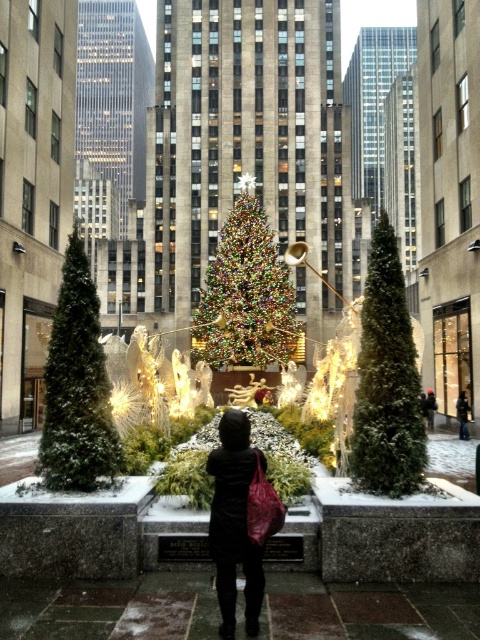
Measure the distance from black matte coat at center to orange knit hat at center.

black matte coat at center is 40.80 meters away from orange knit hat at center.

Does black matte coat at center have a greater height compared to orange knit hat at center?

Indeed, black matte coat at center has a greater height compared to orange knit hat at center.

Is point (238, 449) less distant than point (429, 396)?

That is True.

At what (x,y) coordinates should I click in order to perform the action: click on black matte coat at center. Please return your answer as a coordinate pair (x, y). Image resolution: width=480 pixels, height=640 pixels. Looking at the image, I should click on (235, 522).

Can you confirm if green textured christmas tree at left is taller than black leather jacket at center?

Yes.

Describe the element at coordinates (76, 387) in the screenshot. The image size is (480, 640). I see `green textured christmas tree at left` at that location.

Locate an element on the screen. This screenshot has height=640, width=480. green textured christmas tree at left is located at coordinates (76, 387).

Does shiny multicolored tree at center have a lesser width compared to black matte coat at center?

No.

Is point (259, 317) farther from viewer compared to point (223, 417)?

Yes, it is.

Does point (273, 269) lie behind point (225, 465)?

Yes, point (273, 269) is farther from viewer.

The width and height of the screenshot is (480, 640). In order to click on shiny multicolored tree at center in this screenshot , I will do `click(245, 294)`.